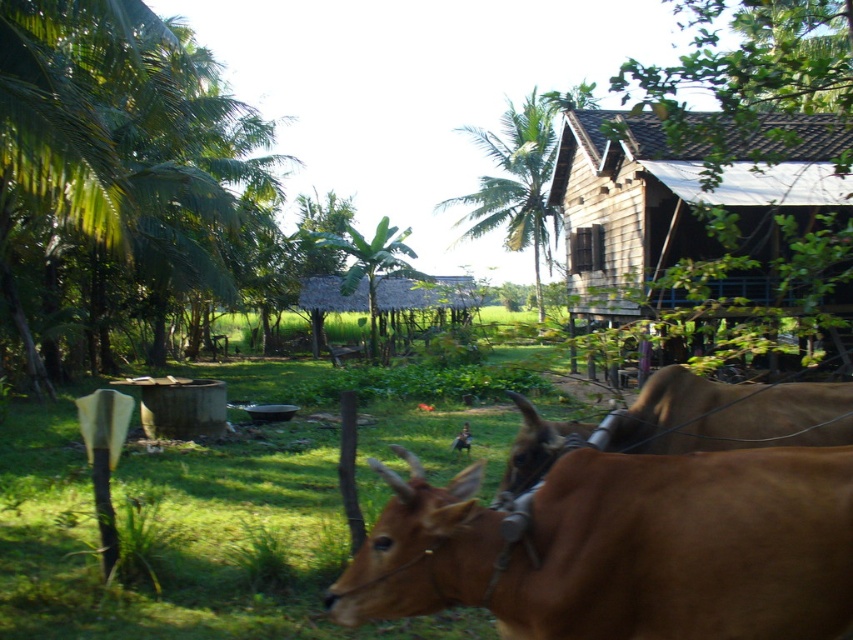
You are standing in the rural tropical area shown in the image. You see two points marked as point 1 and point 2. Point 1 is at coordinate (318,621) and point 2 is at (781,202). Which point is closer to you?

Point 1 at coordinate (318,621) is closer to you because it is in front of point 2 at (781,202).

You are a farmer in this tropical area and want to plant a new crop that requires short vegetation to allow sunlight. Which area between the green grass at center and the green leafy palm tree at center would be better for planting?

The green grass at center has a lesser height compared to the green leafy palm tree at center, so planting in the area with green grass at center would be better since it allows more sunlight to reach the crops.